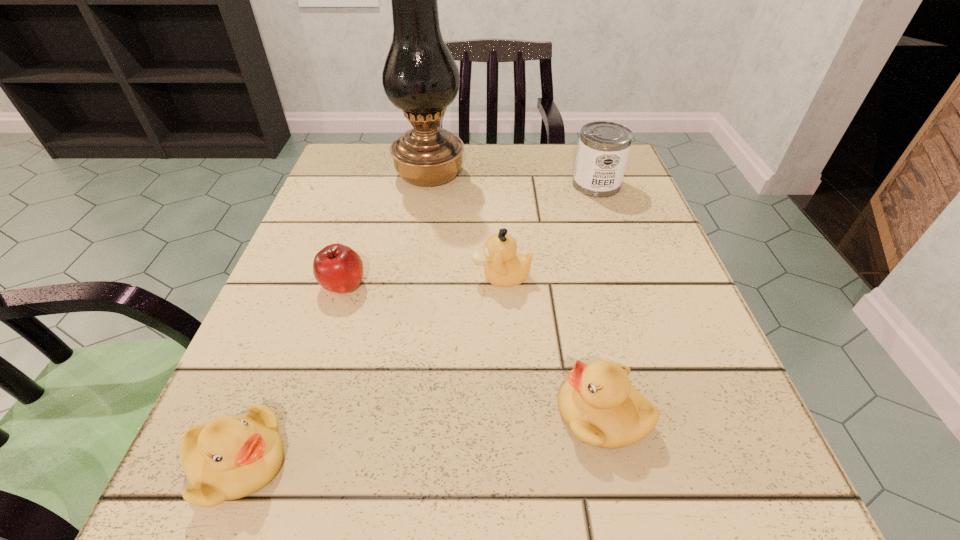
In the image, there is a desktop. At what (x,y) coordinates should I click in order to perform the action: click on free space at the left edge. Please return your answer as a coordinate pair (x, y). The width and height of the screenshot is (960, 540). Looking at the image, I should click on (332, 325).

In the image, there is a desktop. Identify the location of vacant space at the right edge. (641, 208).

Find the location of a particular element. This screenshot has width=960, height=540. free point at the near right corner is located at coordinates (706, 528).

Find the location of a particular element. Image resolution: width=960 pixels, height=540 pixels. free space between the can and the tallest object is located at coordinates (513, 179).

Where is `vacant space that is in between the second duckling from left to right and the rightmost duckling`? vacant space that is in between the second duckling from left to right and the rightmost duckling is located at coordinates (552, 346).

Locate an element on the screen. blank region between the leftmost duckling and the apple is located at coordinates (291, 374).

Identify the location of vacant area that lies between the tallest object and the leftmost duckling. pos(334,318).

The image size is (960, 540). Find the location of `free space between the rightmost duckling and the can`. free space between the rightmost duckling and the can is located at coordinates (599, 299).

The height and width of the screenshot is (540, 960). What are the coordinates of `unoccupied area between the apple and the leftmost duckling` in the screenshot? It's located at click(291, 374).

Identify the location of vacant space that is in between the apple and the leftmost duckling. This screenshot has height=540, width=960. (291, 374).